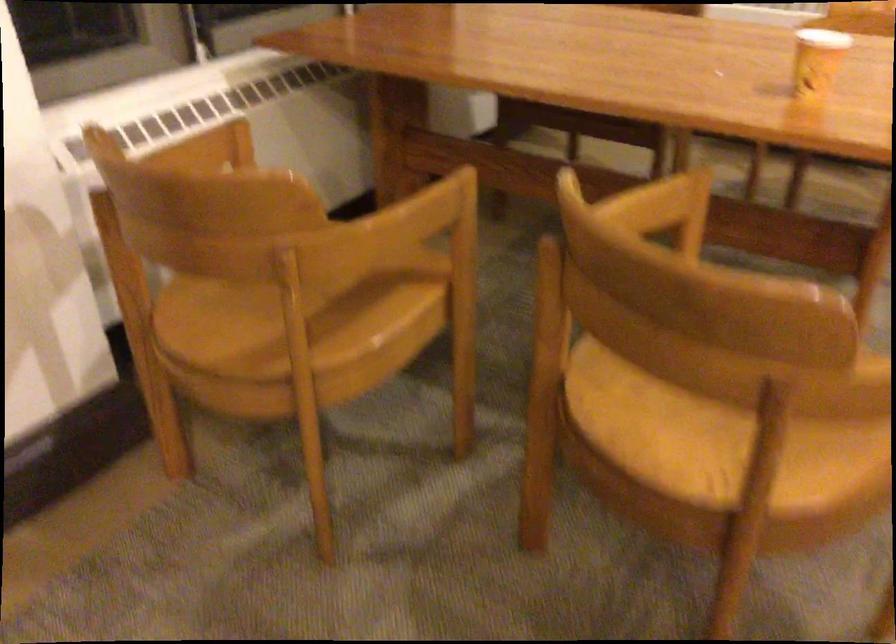
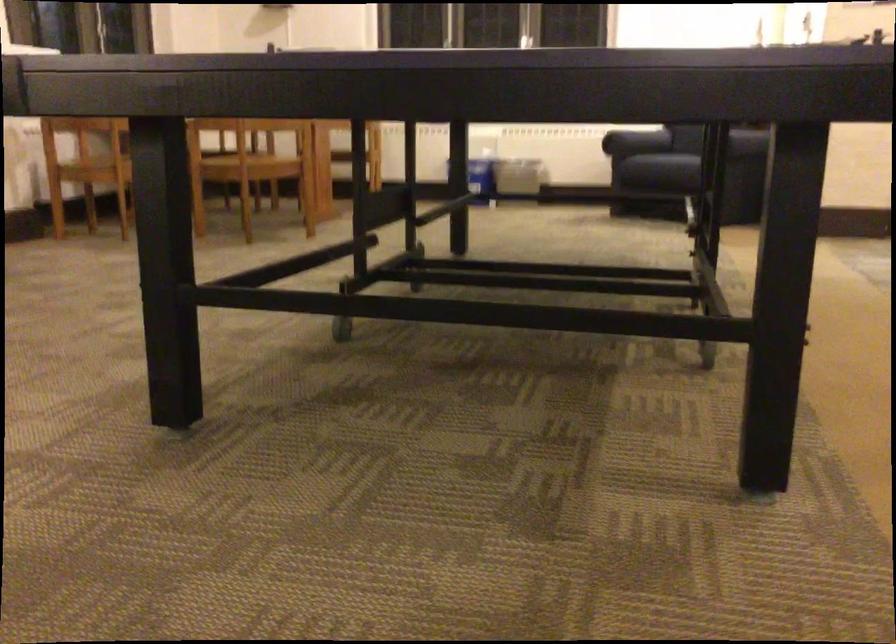
Locate, in the second image, the point that corresponds to (234,345) in the first image.

(95, 169)